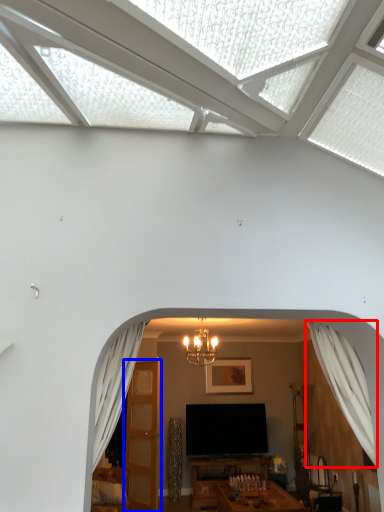
Question: Which of the following is the farthest to the observer, curtain (highlighted by a red box) or door (highlighted by a blue box)?

Choices:
 (A) curtain
 (B) door

Answer: (B)